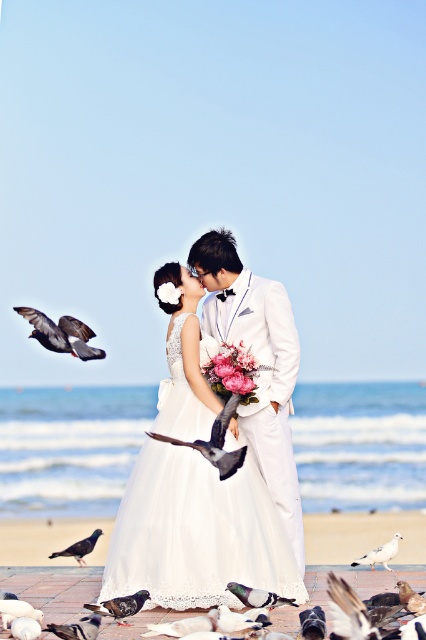
Question: Can you confirm if smooth gray pigeon at lower left is positioned above white feathered bird at center?

Choices:
 (A) no
 (B) yes

Answer: (A)

Question: Is white satin suit at center thinner than gray feathered pigeon at lower left?

Choices:
 (A) no
 (B) yes

Answer: (B)

Question: Is white lace dress at center below gray matte pigeon at lower left?

Choices:
 (A) no
 (B) yes

Answer: (A)

Question: Among these objects, which one is nearest to the camera?

Choices:
 (A) white feathered dove at lower center
 (B) white lace dress at center
 (C) gray feathered bird at center
 (D) smooth gray pigeon at lower left

Answer: (A)

Question: Which point is closer to the camera?

Choices:
 (A) (402, 602)
 (B) (233, 458)
 (C) (203, 621)
 (D) (256, 444)

Answer: (A)

Question: Among these points, which one is farthest from the camera?

Choices:
 (A) (85, 625)
 (B) (394, 547)
 (C) (141, 589)
 (D) (39, 614)

Answer: (B)